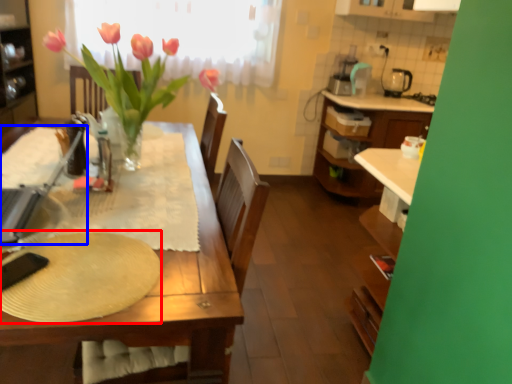
Question: Which point is closer to the camera, paper plate (highlighted by a red box) or appliance (highlighted by a blue box)?

Choices:
 (A) paper plate
 (B) appliance

Answer: (A)